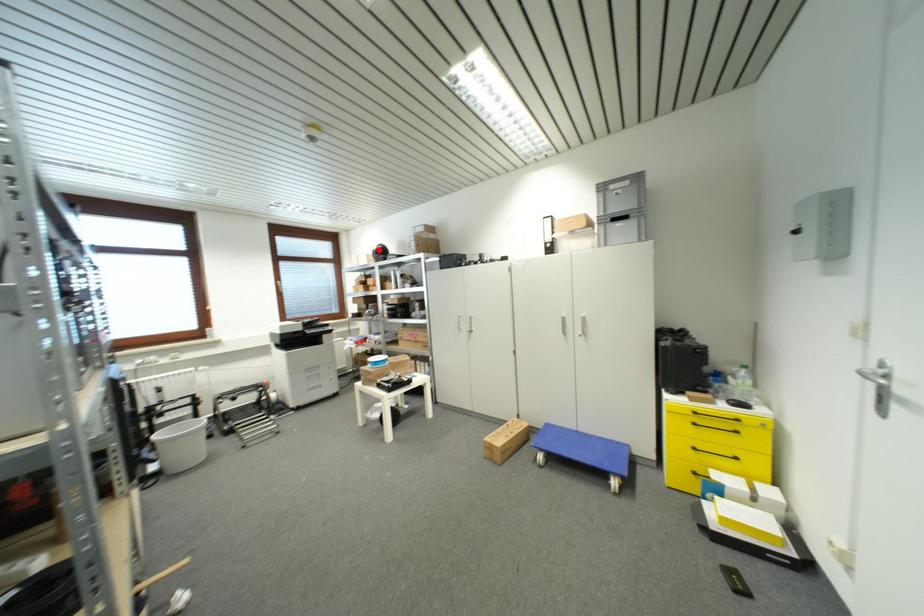
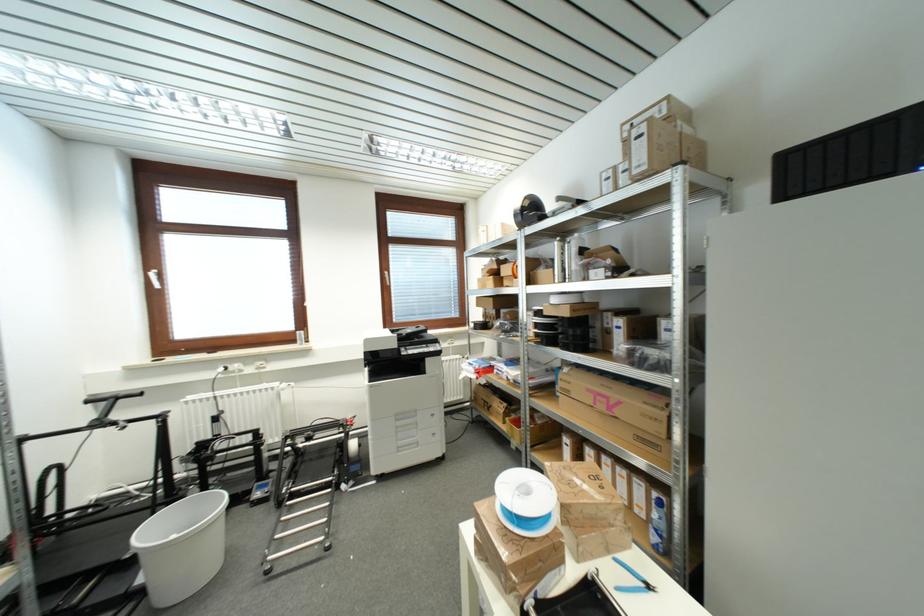
Locate, in the second image, the point that corresponds to the highlighted location in the first image.

(523, 207)